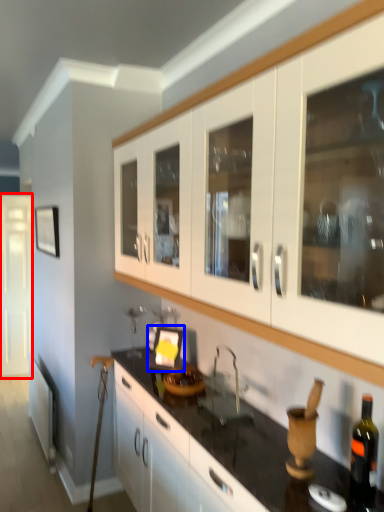
Question: Which of the following is the closest to the observer, glass door (highlighted by a red box) or picture frame (highlighted by a blue box)?

Choices:
 (A) glass door
 (B) picture frame

Answer: (B)